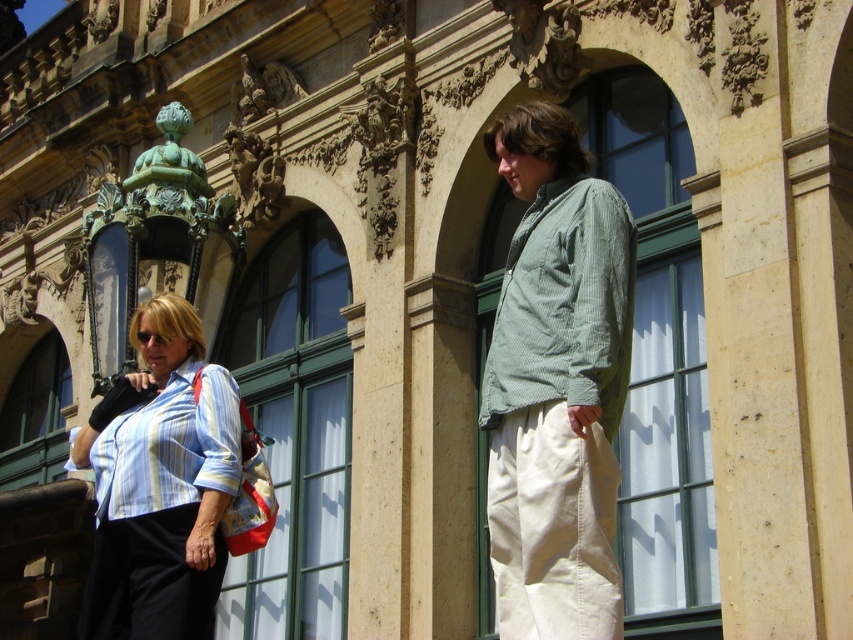
Question: Considering the real-world distances, which object is farthest from the striped cotton shirt at left?

Choices:
 (A) striped cotton shirt at lower left
 (B) green corduroy shirt at upper right

Answer: (B)

Question: Which point is closer to the camera?

Choices:
 (A) (612, 225)
 (B) (76, 445)
 (C) (149, 401)

Answer: (A)

Question: Where is striped cotton shirt at left located in relation to green corduroy shirt at upper right in the image?

Choices:
 (A) below
 (B) above

Answer: (A)

Question: Does green corduroy shirt at center appear on the right side of striped cotton shirt at left?

Choices:
 (A) no
 (B) yes

Answer: (B)

Question: Is green corduroy shirt at upper right smaller than striped cotton shirt at lower left?

Choices:
 (A) no
 (B) yes

Answer: (A)

Question: Which object is farther from the camera taking this photo?

Choices:
 (A) green corduroy shirt at center
 (B) striped cotton shirt at lower left
 (C) green corduroy shirt at upper right

Answer: (B)